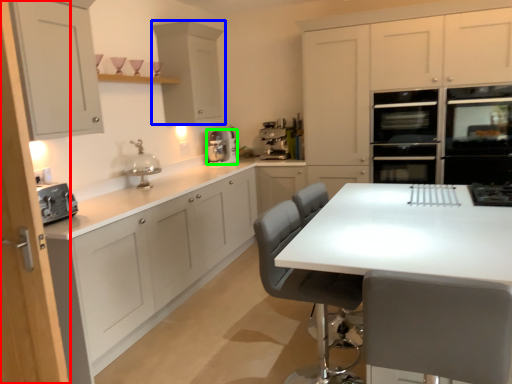
Question: Which is nearer to the cabinetry (highlighted by a red box)? cabinetry (highlighted by a blue box) or kitchen appliance (highlighted by a green box).

Choices:
 (A) cabinetry
 (B) kitchen appliance

Answer: (A)